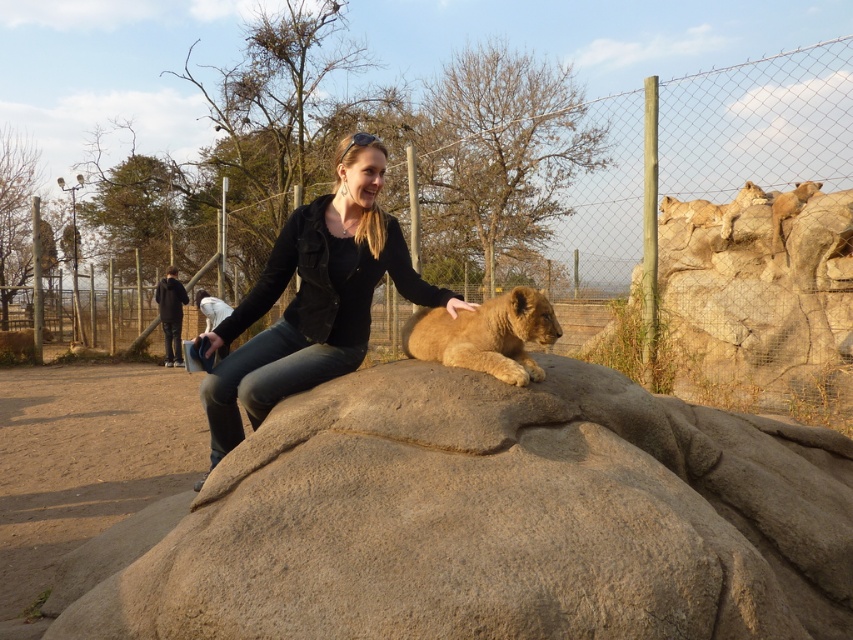
You are a zookeeper who needs to ensure the lion cub at center has enough space to move around. Based on the image, does the golden fur lion cub at center have more or less space compared to the golden fur lion at upper right?

The golden fur lion cub at center occupies less space than the golden fur lion at upper right, so the cub has less space available to move around.

You are a zookeeper who needs to check the golden fur lion at upper right. You are currently standing near the black leather jacket at center. Which direction should you move to reach the lion?

The golden fur lion at upper right is above the black leather jacket at center, so you should move upward to reach the lion.

You are standing at the point marked as point (515, 291) in the wildlife park scene. You want to take a photo of the lion cub resting on the rock formation. Is the point marked as point (315, 326) blocking your view of the lion cub?

Point (315, 326) is behind point (515, 291), so it is not blocking your view of the lion cub from your current position at point (515, 291).